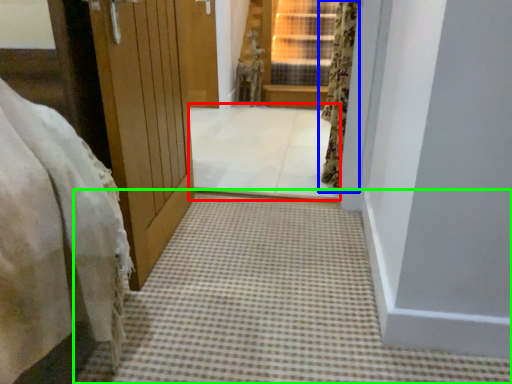
Question: Which object is the farthest from passage (highlighted by a red box)? Choose among these: curtain (highlighted by a blue box) or path (highlighted by a green box).

Choices:
 (A) curtain
 (B) path

Answer: (B)